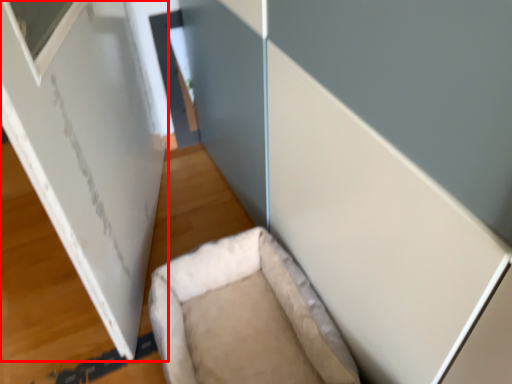
Question: Observing the image, what is the correct spatial positioning of bulletin board (annotated by the red box) in reference to furniture?

Choices:
 (A) right
 (B) left

Answer: (B)